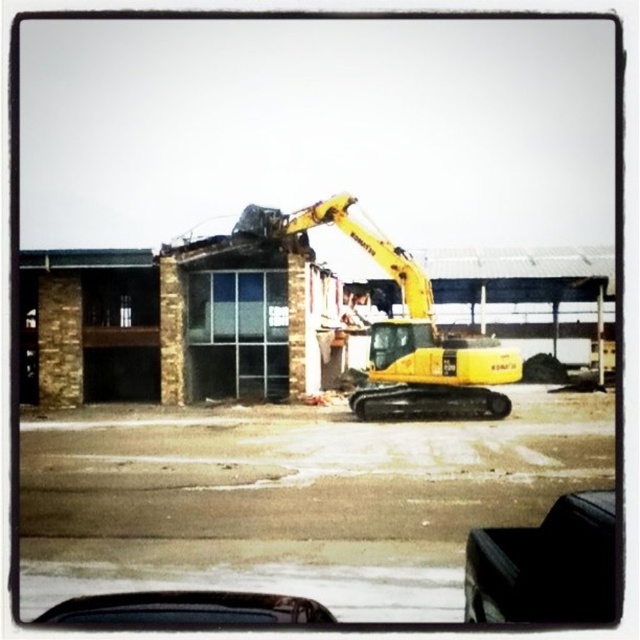
You are a construction worker who needs to move the black leather car at lower right out of the work area. The yellow rubber excavator at center is currently in operation. Can you safely move the car using the excavator without needing to stop the ongoing work?

The yellow rubber excavator at center is larger in size than the black leather car at lower right, so it can safely move the car without needing to stop the ongoing work.

You are a delivery driver who needs to park your truck between the black leather car at lower right and the black matte car at lower center. Can you fit your truck, which is 2.5 meters wide, in the space between them?

The black leather car at lower right has a lesser width compared to black matte car at lower center. The space between them may be sufficient for your truck, but the exact width isn

You are a delivery person who needs to drive the black matte car at lower center under the yellow rubber excavator at center. Can the car pass underneath without hitting the excavator?

The yellow rubber excavator at center is taller than the black matte car at lower center, so the car can pass underneath without any issues.